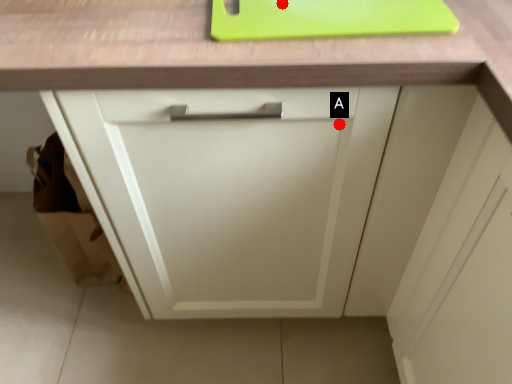
Question: Two points are circled on the image, labeled by A and B beside each circle. Which of the following is the closest to the observer?

Choices:
 (A) A is closer
 (B) B is closer

Answer: (B)